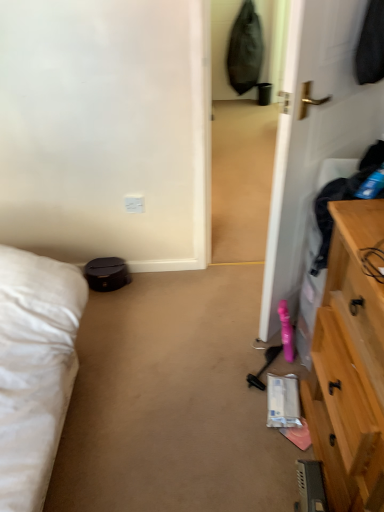
Question: Does white plastic electric outlet at center come behind white glossy door at right?

Choices:
 (A) no
 (B) yes

Answer: (B)

Question: From the image's perspective, is white plastic electric outlet at center below white glossy door at right?

Choices:
 (A) no
 (B) yes

Answer: (B)

Question: Does white plastic electric outlet at center appear on the left side of white glossy door at right?

Choices:
 (A) no
 (B) yes

Answer: (B)

Question: Are white plastic electric outlet at center and white glossy door at right located far from each other?

Choices:
 (A) yes
 (B) no

Answer: (B)

Question: Does white plastic electric outlet at center come in front of white glossy door at right?

Choices:
 (A) yes
 (B) no

Answer: (B)

Question: Is white glossy door at right at the back of white plastic electric outlet at center?

Choices:
 (A) yes
 (B) no

Answer: (B)

Question: From the image's perspective, is white glossy door at right on white plastic electric outlet at center?

Choices:
 (A) no
 (B) yes

Answer: (B)

Question: From the image's perspective, would you say white glossy door at right is shown under white plastic electric outlet at center?

Choices:
 (A) no
 (B) yes

Answer: (A)

Question: Does white glossy door at right have a greater width compared to white plastic electric outlet at center?

Choices:
 (A) yes
 (B) no

Answer: (A)

Question: Does white glossy door at right have a smaller size compared to white plastic electric outlet at center?

Choices:
 (A) yes
 (B) no

Answer: (B)

Question: Is white glossy door at right in front of white plastic electric outlet at center?

Choices:
 (A) yes
 (B) no

Answer: (A)

Question: Considering the relative sizes of white glossy door at right and white plastic electric outlet at center in the image provided, is white glossy door at right thinner than white plastic electric outlet at center?

Choices:
 (A) no
 (B) yes

Answer: (A)

Question: Considering the positions of point (125, 201) and point (284, 209), is point (125, 201) closer or farther from the camera than point (284, 209)?

Choices:
 (A) farther
 (B) closer

Answer: (A)